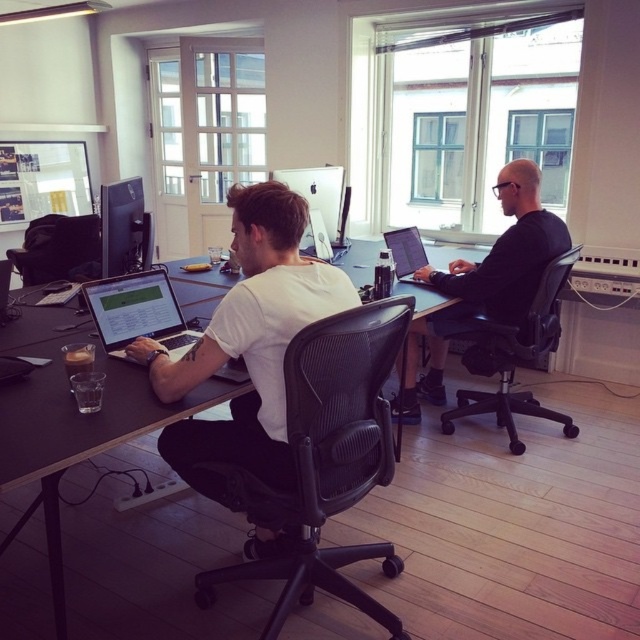
From the picture: You are standing in the office and see the point at coordinates (508, 252). Which object is this point located on?

The point at coordinates (508, 252) is located on the black matte shirt at center.

You are an office worker who just entered the room and wants to sit at the desk. There is a black matte shirt at center and a matte white monitor at center. Which object should you avoid placing your coffee cup on to prevent spills?

You should avoid placing your coffee cup on the black matte shirt at center to prevent spills, as it is a clothing item and not a surface.

You are an office worker who wants to place a new keyboard between the white matte shirt at center and the matte black monitor at upper left. Based on their positions, where should the keyboard be placed relative to these two items?

The white matte shirt at center is located below the matte black monitor at upper left, so the keyboard should be placed between them in the lower position near the shirt to maintain proper ergonomics.